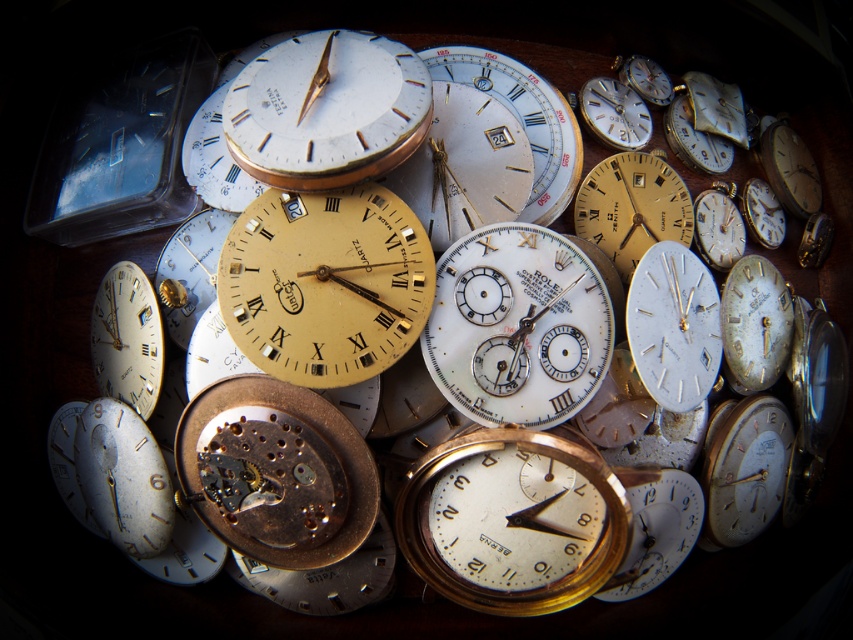
You are examining the intricate gears of a vintage watch movement. There are two points marked on the mechanism at coordinates point [637,316] and point [633,259]. Which point is positioned closer to you as you look at the watch?

Point [637,316] is closer to the viewer than point [633,259].

You are a watchmaker examining the collection. You need to place both the white metallic watch face at center and the matte gold watch face at lower left into a display case. The case has a height limit of 10 cm. If the shorter watch face is 8 cm tall, will both fit vertically?

The white metallic watch face at center is shorter than the matte gold watch face at lower left. Since the shorter one is 8 cm, the taller one must be over 8 cm. The total height needed would exceed 10 cm, so they won